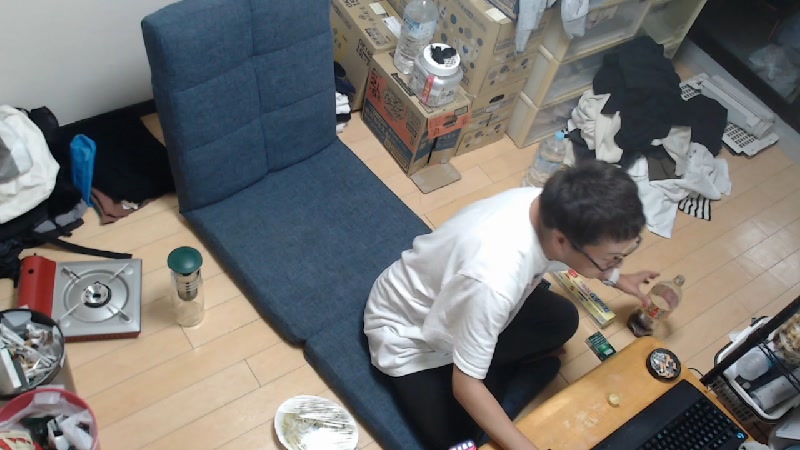
In order to click on keyboard in this screenshot , I will do `click(702, 433)`.